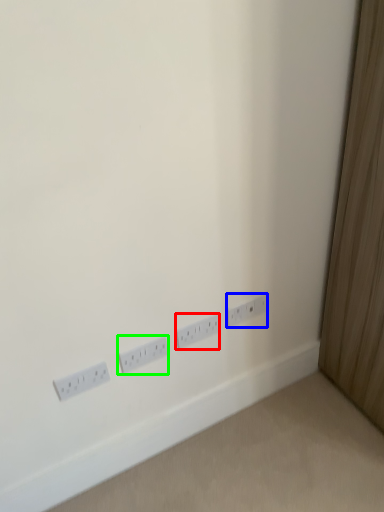
Question: Which object is the farthest from power plugs and sockets (highlighted by a red box)? Choose among these: power plugs and sockets (highlighted by a blue box) or power plugs and sockets (highlighted by a green box).

Choices:
 (A) power plugs and sockets
 (B) power plugs and sockets

Answer: (B)